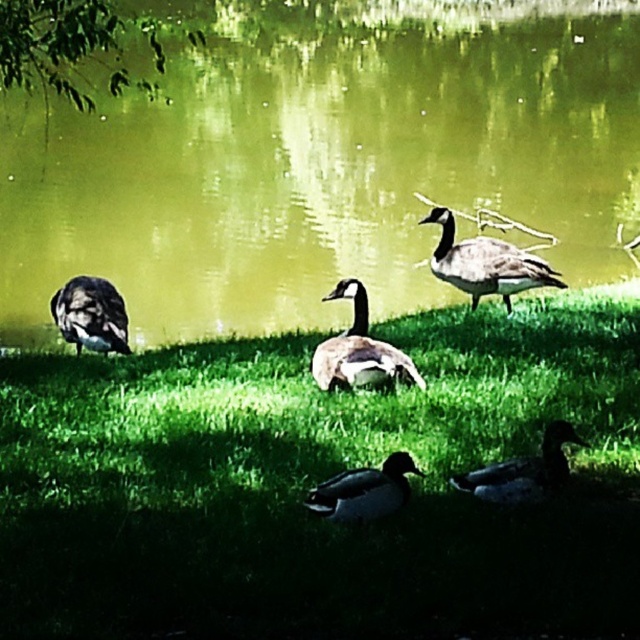
Does gray feathered goose at upper right appear on the left side of greenish-gray feathers at lower right?

No, gray feathered goose at upper right is not to the left of greenish-gray feathers at lower right.

Image resolution: width=640 pixels, height=640 pixels. What do you see at coordinates (484, 262) in the screenshot?
I see `gray feathered goose at upper right` at bounding box center [484, 262].

The height and width of the screenshot is (640, 640). What do you see at coordinates (484, 262) in the screenshot? I see `gray feathered goose at upper right` at bounding box center [484, 262].

Where is `gray feathered goose at upper right`? This screenshot has height=640, width=640. gray feathered goose at upper right is located at coordinates (484, 262).

Can you confirm if green grassy at center is taller than gray feathered goose at upper right?

No, green grassy at center is not taller than gray feathered goose at upper right.

Looking at this image, between green grassy at center and gray feathered goose at upper right, which one appears on the left side from the viewer's perspective?

green grassy at center is more to the left.

You are a GUI agent. You are given a task and a screenshot of the screen. Output one action in this format:
    pyautogui.click(x=<x>, y=<y>)
    Task: Click on the green grassy at center
    The image size is (640, 640).
    Given the screenshot: What is the action you would take?
    pyautogui.click(x=317, y=481)

Locate an element on the screen. Image resolution: width=640 pixels, height=640 pixels. green grassy at center is located at coordinates (317, 481).

Which is in front, point (348, 493) or point (129, 349)?

Point (348, 493) is in front.

Can you confirm if dark green matte duck at center is smaller than dark brown feathers at lower left?

Yes.

Is point (342, 483) positioned behind point (93, 307)?

No, (342, 483) is closer to viewer.

Where is `dark green matte duck at center`? The width and height of the screenshot is (640, 640). dark green matte duck at center is located at coordinates (364, 490).